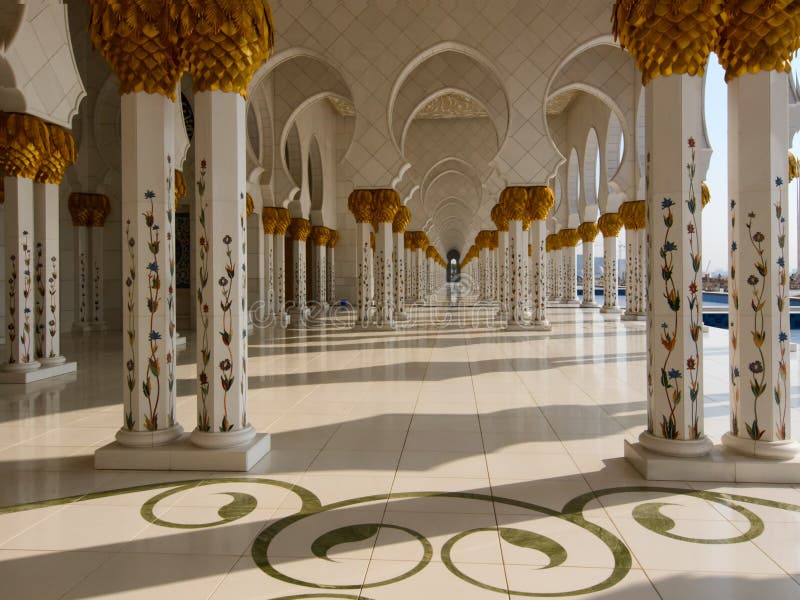
Find the location of a particular element. Image resolution: width=800 pixels, height=600 pixels. doorway is located at coordinates (454, 265).